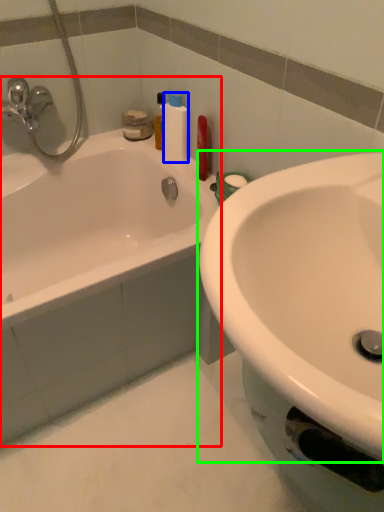
Question: Estimate the real-world distances between objects in this image. Which object is closer to bathtub (highlighted by a red box), cleaning product (highlighted by a blue box) or sink (highlighted by a green box)?

Choices:
 (A) cleaning product
 (B) sink

Answer: (A)